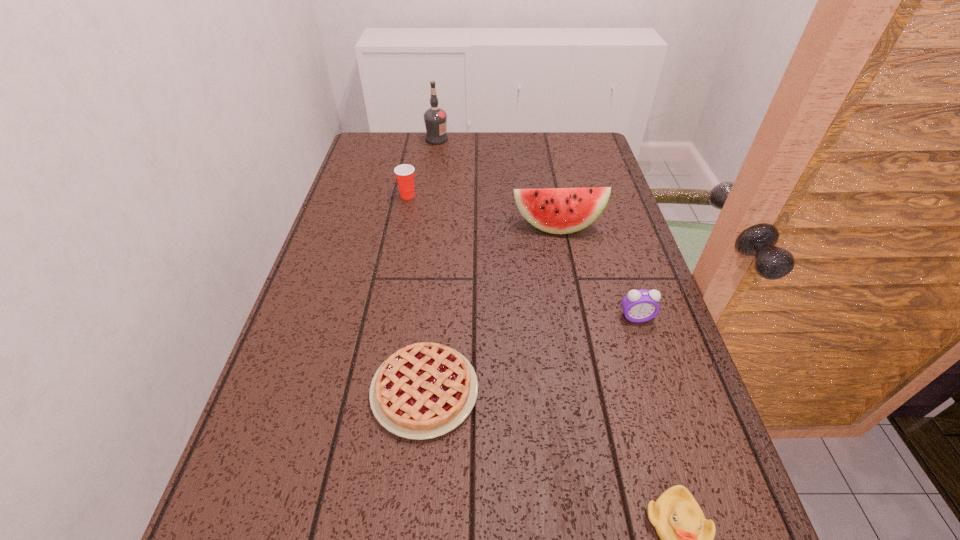
Locate an element on the screen. vacant area at the far right corner of the desktop is located at coordinates [x=565, y=166].

You are a GUI agent. You are given a task and a screenshot of the screen. Output one action in this format:
    pyautogui.click(x=<x>, y=<y>)
    Task: Click on the vacant region between the farthest object and the pie
    
    Given the screenshot: What is the action you would take?
    pyautogui.click(x=431, y=265)

Identify the location of vacant area that lies between the Dixie cup and the alarm clock. The height and width of the screenshot is (540, 960). (522, 256).

You are a GUI agent. You are given a task and a screenshot of the screen. Output one action in this format:
    pyautogui.click(x=<x>, y=<y>)
    Task: Click on the free space between the Dixie cup and the farthest object
    The height and width of the screenshot is (540, 960).
    Given the screenshot: What is the action you would take?
    pyautogui.click(x=422, y=167)

You are a GUI agent. You are given a task and a screenshot of the screen. Output one action in this format:
    pyautogui.click(x=<x>, y=<y>)
    Task: Click on the object that is the fifth closest to the fourth nearest object
    
    Given the screenshot: What is the action you would take?
    pyautogui.click(x=687, y=539)

At what (x,y) coordinates should I click in order to perform the action: click on the fourth closest object relative to the tallest object. Please return your answer as a coordinate pair (x, y). Looking at the image, I should click on point(639,306).

Identify the location of vacant space that satisfies the following two spatial constraints: 1. on the front side of the fifth nearest object; 2. on the right side of the shortest object. (369, 390).

The width and height of the screenshot is (960, 540). I want to click on vacant region that satisfies the following two spatial constraints: 1. on the front label of the shortest object; 2. on the left side of the vodka, so click(401, 390).

Where is `free location that satisfies the following two spatial constraints: 1. on the front label of the farthest object; 2. on the left side of the shortest object`? The height and width of the screenshot is (540, 960). free location that satisfies the following two spatial constraints: 1. on the front label of the farthest object; 2. on the left side of the shortest object is located at coordinates (401, 390).

Where is `free location that satisfies the following two spatial constraints: 1. on the front label of the farthest object; 2. on the back side of the second nearest object`? The width and height of the screenshot is (960, 540). free location that satisfies the following two spatial constraints: 1. on the front label of the farthest object; 2. on the back side of the second nearest object is located at coordinates (401, 390).